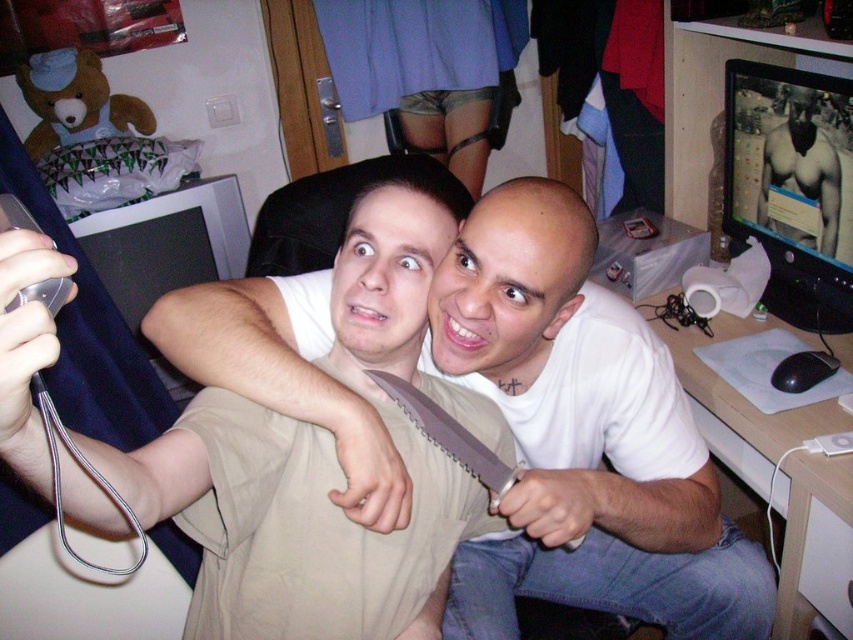
Question: Considering the real-world distances, which object is closest to the matte black monitor at upper right?

Choices:
 (A) black matte monitor at left
 (B) beige fabric knife at upper center

Answer: (B)

Question: Which of the following is the closest to the observer?

Choices:
 (A) (790, 211)
 (B) (761, 196)
 (C) (125, 272)

Answer: (A)

Question: Can you confirm if beige fabric knife at upper center is bigger than black matte monitor at left?

Choices:
 (A) no
 (B) yes

Answer: (B)

Question: Does white matte shirt at center appear over black matte monitor at left?

Choices:
 (A) no
 (B) yes

Answer: (A)

Question: Which object appears closest to the camera in this image?

Choices:
 (A) matte black monitor at upper right
 (B) smooth skin torso at upper right
 (C) beige fabric knife at upper center

Answer: (C)

Question: Can you confirm if white matte shirt at center is wider than beige fabric knife at upper center?

Choices:
 (A) yes
 (B) no

Answer: (A)